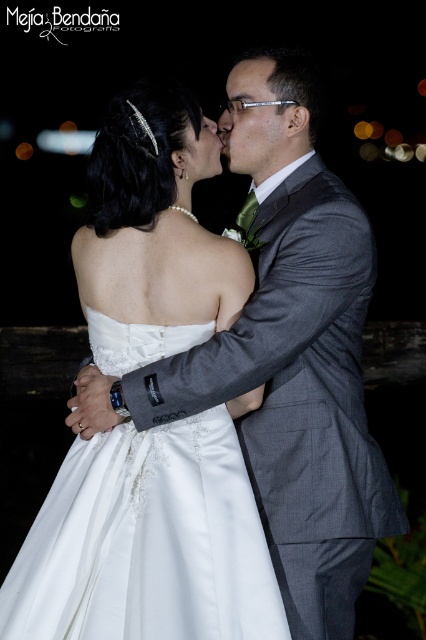
Between gray textured suit at center and white satin dress at center, which one has less height?

With less height is white satin dress at center.

Who is more distant from viewer, (x=337, y=272) or (x=112, y=604)?

Positioned behind is point (x=337, y=272).

What do you see at coordinates (305, 356) in the screenshot? I see `gray textured suit at center` at bounding box center [305, 356].

Locate an element on the screen. This screenshot has height=640, width=426. gray textured suit at center is located at coordinates (305, 356).

Find the location of `gray textured suit at center`. gray textured suit at center is located at coordinates (305, 356).

Does point (363, 243) lie in front of point (253, 90)?

Yes, it is in front of point (253, 90).

The width and height of the screenshot is (426, 640). Find the location of `gray textured suit at center`. gray textured suit at center is located at coordinates (305, 356).

Is white satin dress at center smaller than matte black forehead at center?

Actually, white satin dress at center might be larger than matte black forehead at center.

Does point (227, 465) come farther from viewer compared to point (244, 88)?

No, it is not.

Who is more distant from viewer, (112, 492) or (244, 61)?

The point (244, 61) is more distant.

Identify the location of white satin dress at center. This screenshot has height=640, width=426. (146, 541).